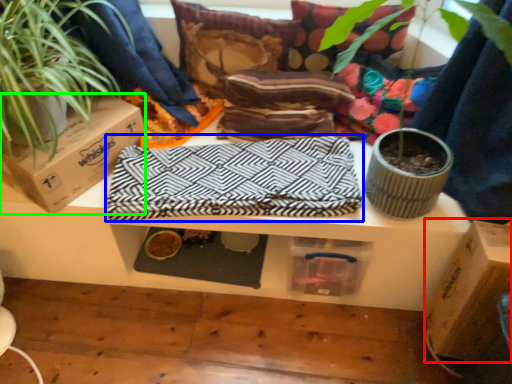
Question: Which object is the farthest from cardboard box (highlighted by a red box)? Choose among these: blanket (highlighted by a blue box) or cardboard box (highlighted by a green box).

Choices:
 (A) blanket
 (B) cardboard box

Answer: (B)